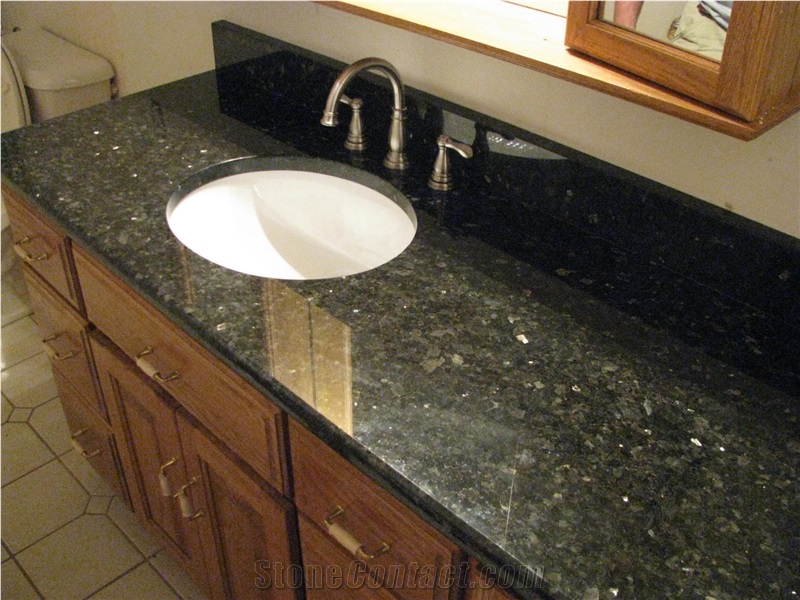
This screenshot has width=800, height=600. Identify the location of faucet. (398, 120).